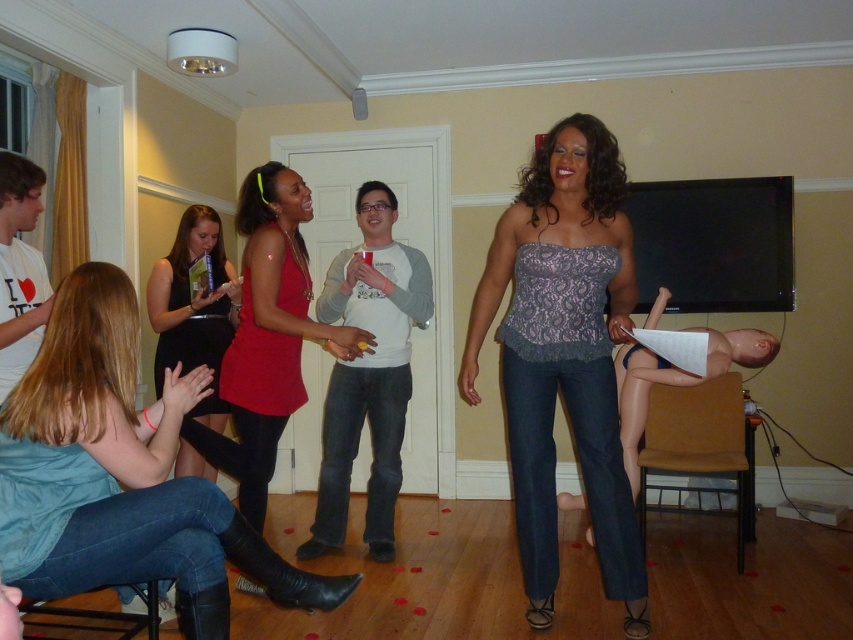
Question: Can you confirm if lace-like fabric top at center is positioned below matte red dress at center?

Choices:
 (A) yes
 (B) no

Answer: (A)

Question: Estimate the real-world distances between objects in this image. Which object is closer to the black satin dress at lower left?

Choices:
 (A) lace-like fabric top at center
 (B) matte red dress at center
 (C) denim jeans at lower left

Answer: (B)

Question: Can you confirm if denim jeans at lower left is wider than black satin dress at lower left?

Choices:
 (A) yes
 (B) no

Answer: (A)

Question: Is denim jeans at lower left to the right of matte red dress at center from the viewer's perspective?

Choices:
 (A) yes
 (B) no

Answer: (B)

Question: Estimate the real-world distances between objects in this image. Which object is farther from the matte red dress at center?

Choices:
 (A) denim jeans at lower left
 (B) black satin dress at lower left
 (C) lace-like fabric top at center

Answer: (C)

Question: Which of these objects is positioned farthest from the denim jeans at lower left?

Choices:
 (A) black satin dress at lower left
 (B) matte red dress at center
 (C) lace-like fabric top at center

Answer: (A)